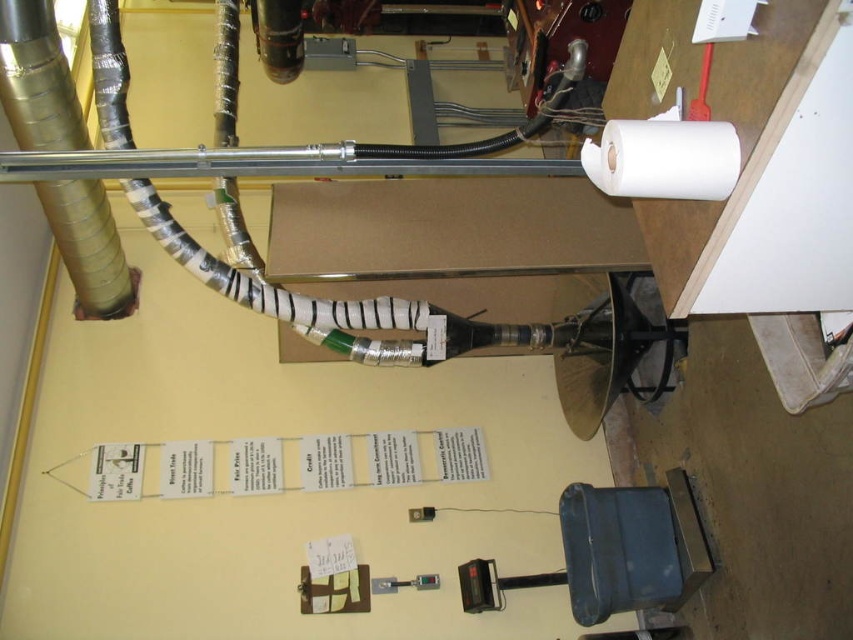
Question: Among these points, which one is nearest to the camera?

Choices:
 (A) (80, 188)
 (B) (701, 141)

Answer: (B)

Question: Among these points, which one is nearest to the camera?

Choices:
 (A) (730, 179)
 (B) (88, 204)

Answer: (A)

Question: Does gold metallic pipe at left lie in front of white matte toilet paper at upper right?

Choices:
 (A) yes
 (B) no

Answer: (B)

Question: Is gold metallic pipe at left bigger than white matte toilet paper at upper right?

Choices:
 (A) yes
 (B) no

Answer: (A)

Question: Is gold metallic pipe at left in front of white matte toilet paper at upper right?

Choices:
 (A) no
 (B) yes

Answer: (A)